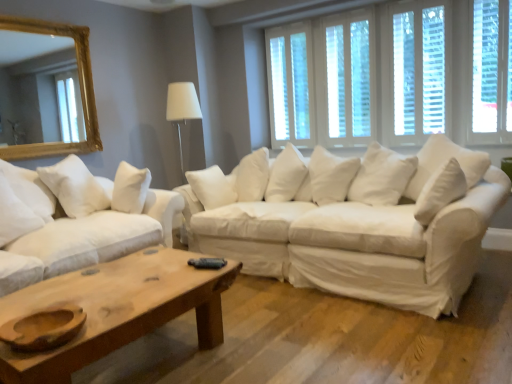
You are a GUI agent. You are given a task and a screenshot of the screen. Output one action in this format:
    pyautogui.click(x=<x>, y=<y>)
    Task: Click on the vacant area on top of gold-framed mirror at upper left (from a real-world perspective)
    This screenshot has width=512, height=384.
    Given the screenshot: What is the action you would take?
    pyautogui.click(x=35, y=11)